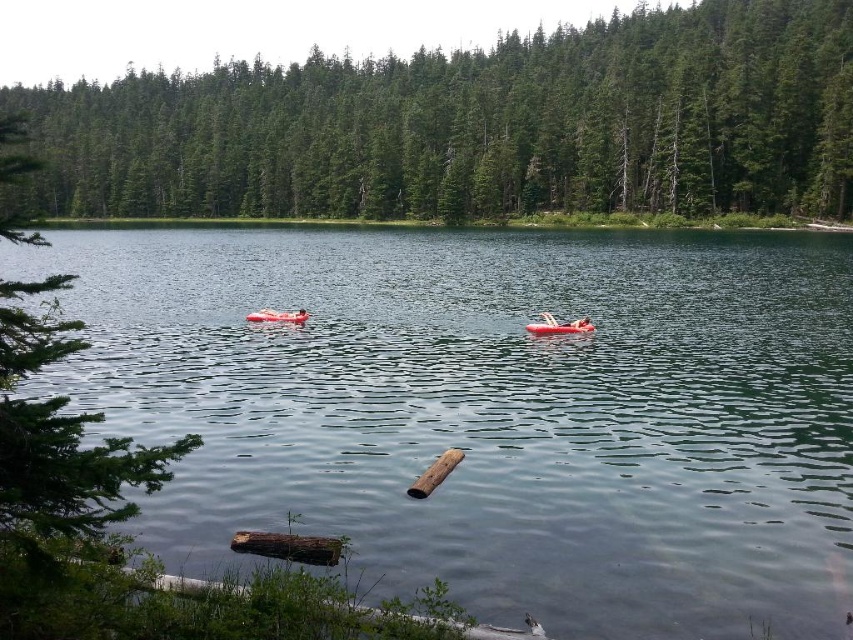
You are planning to take a swim in the lake. You see the clear water at center and the rubber red boat at center. Which object is deeper in the water?

The clear water at center is much taller than the rubber red boat at center, so the clear water at center is deeper in the water.

You are standing at the lakeside and want to locate two points marked in the scene. The first point is at coordinates point (741,180) and the second is at point (538,330). Which point is closer to you?

Point (741,180) is closer to you because it is further to the viewer than point (538,330).

You are planning to swim from the brown wood log at center to the rubber red boat at center. Given that the average swimming speed is 1.5 meters per second, how long will it take to reach the boat?

The brown wood log at center is 19.16 meters from rubber red boat at center. At an average swimming speed of 1.5 meters per second, it would take approximately 12.77 seconds to reach the boat.